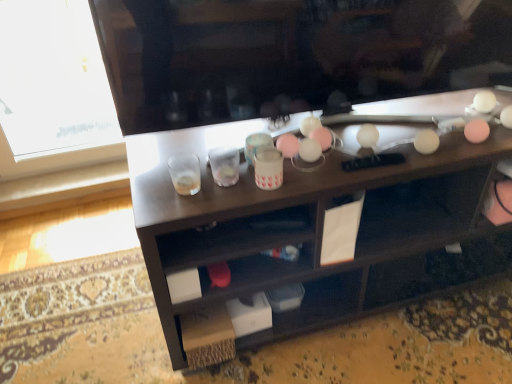
Question: In the image, is pink matte cup at center positioned in front of or behind translucent glass at center, which ranks as the second shot glass in right-to-left order?

Choices:
 (A) front
 (B) behind

Answer: (A)

Question: From their relative heights in the image, would you say pink matte cup at center is taller or shorter than translucent glass at center, which ranks as the second shot glass in right-to-left order?

Choices:
 (A) tall
 (B) short

Answer: (A)

Question: Which object is positioned farthest from the wooden desk at center?

Choices:
 (A) clear plastic shot glass at center, which is counted as the 2th shot glass, starting from the left
 (B) translucent glass at center, placed as the first shot glass when sorted from left to right
 (C) pink matte cup at center

Answer: (B)

Question: Considering the real-world distances, which object is closest to the translucent glass at center, placed as the first shot glass when sorted from left to right?

Choices:
 (A) clear plastic shot glass at center, the 1th shot glass from the right
 (B) wooden desk at center
 (C) pink matte cup at center

Answer: (A)